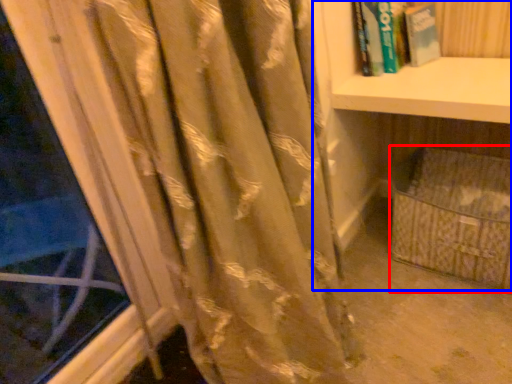
Question: Which of the following is the closest to the observer, basket (highlighted by a red box) or bookcase (highlighted by a blue box)?

Choices:
 (A) basket
 (B) bookcase

Answer: (B)